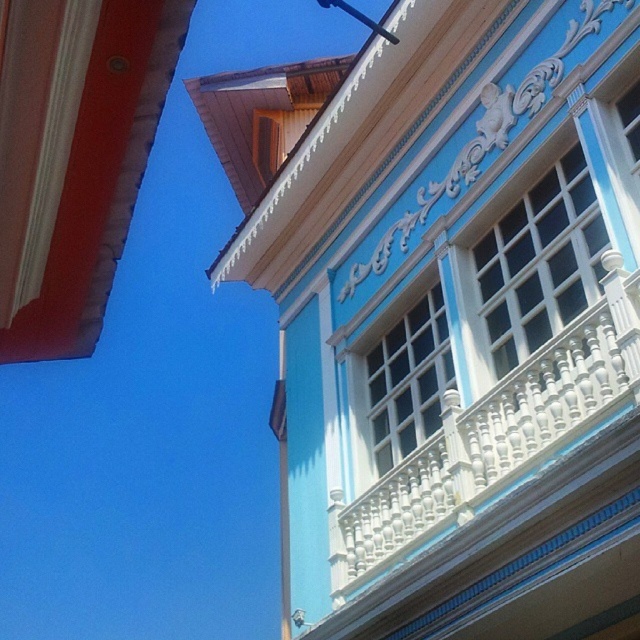
You are a painter standing at the base of the building. You need to paint both the white wooden window at center and the metallic pole at upper center. If your ladder can extend up to 9 meters, will you be able to reach both objects with the same ladder?

The distance between the white wooden window at center and the metallic pole at upper center is 9.15 meters. Since the ladder can only extend up to 9 meters, it is 15 centimeters too short to reach both objects with the same ladder.

You are standing in front of the building and notice the white wooden window at center and the metallic pole at upper center. Which object is positioned higher up on the building?

The metallic pole at upper center is positioned higher up on the building than the white wooden window at center.

Consider the image. You are standing in front of the building and notice two points on its facade. The first point is at coordinates point (444, 362) and the second is at point (342, 1). From your perspective, which point is closer to you?

Point (342, 1) is closer to you because it is in front of point (444, 362).